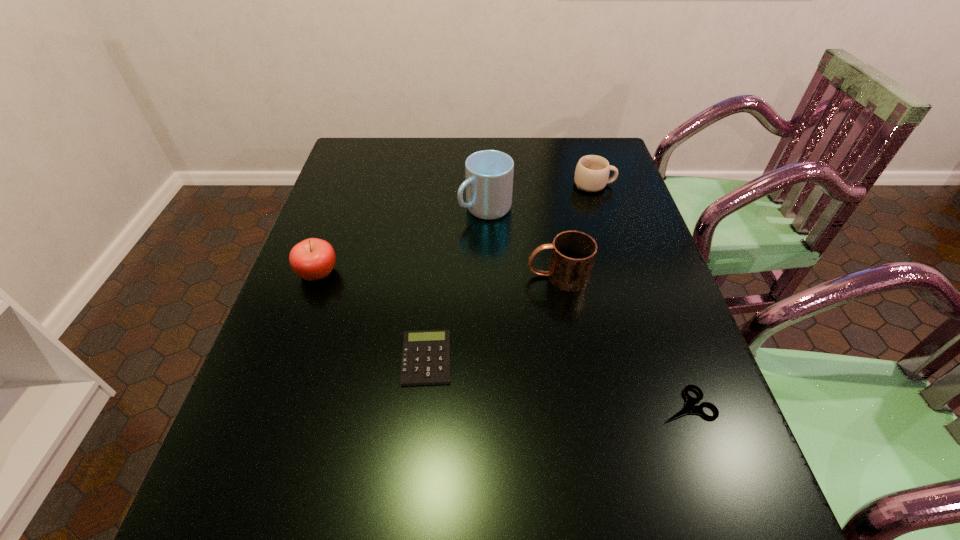
At what (x,y) coordinates should I click in order to perform the action: click on mug positioned at the right edge. Please return your answer as a coordinate pair (x, y). This screenshot has width=960, height=540. Looking at the image, I should click on (592, 172).

I want to click on shears at the right edge, so click(x=690, y=407).

This screenshot has height=540, width=960. Identify the location of object at the far right corner. (592, 172).

Image resolution: width=960 pixels, height=540 pixels. Find the location of `vacant region at the far edge of the desktop`. vacant region at the far edge of the desktop is located at coordinates (540, 139).

This screenshot has height=540, width=960. I want to click on vacant area at the left edge, so click(x=301, y=365).

You are a GUI agent. You are given a task and a screenshot of the screen. Output one action in this format:
    pyautogui.click(x=<x>, y=<y>)
    Task: Click on the vacant area at the right edge
    Image resolution: width=960 pixels, height=540 pixels.
    Given the screenshot: What is the action you would take?
    pyautogui.click(x=612, y=243)

This screenshot has height=540, width=960. In the image, there is a desktop. Find the location of `vacant region at the far left corner`. vacant region at the far left corner is located at coordinates (372, 158).

Where is `vacant space at the near right corner of the desktop`? vacant space at the near right corner of the desktop is located at coordinates (722, 532).

The image size is (960, 540). Identify the location of free spot between the calculator and the leftmost object. (372, 316).

Locate an element on the screen. unoccupied area between the leftmost object and the nearest mug is located at coordinates (438, 274).